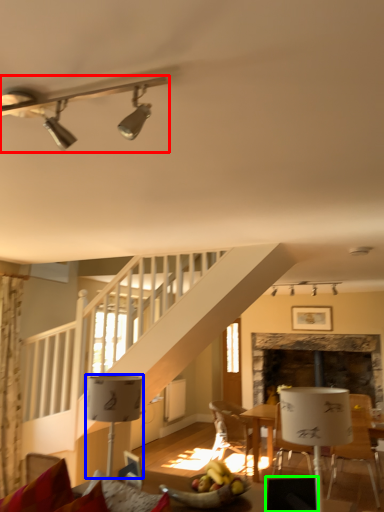
Question: Based on their relative distances, which object is nearer to lamp (highlighted by a red box)? Choose from lamp (highlighted by a blue box) and armchair (highlighted by a green box).

Choices:
 (A) lamp
 (B) armchair

Answer: (A)